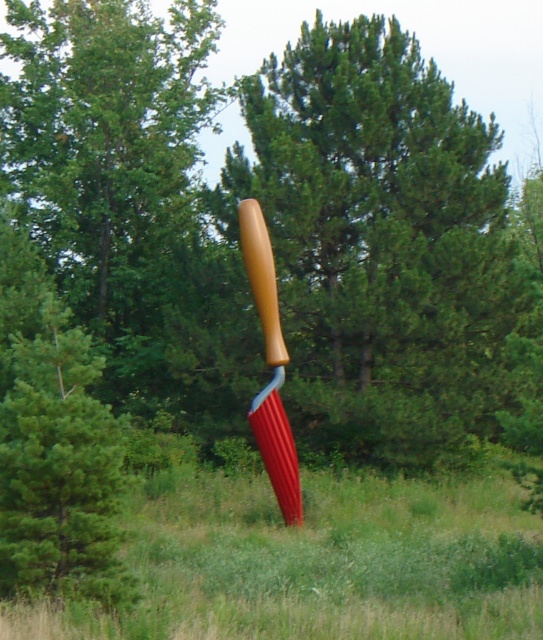
Question: Which of the following is the farthest from the observer?

Choices:
 (A) wooden handle baseball bat at center
 (B) smooth brown handle at center

Answer: (B)

Question: Observing the image, what is the correct spatial positioning of smooth brown handle at center in reference to wooden handle baseball bat at center?

Choices:
 (A) right
 (B) left

Answer: (A)

Question: Where is smooth brown handle at center located in relation to wooden handle baseball bat at center in the image?

Choices:
 (A) below
 (B) above

Answer: (B)

Question: Which point is closer to the camera taking this photo?

Choices:
 (A) (263, 400)
 (B) (409, 333)

Answer: (A)

Question: Can you confirm if smooth brown handle at center is positioned to the left of wooden handle baseball bat at center?

Choices:
 (A) no
 (B) yes

Answer: (A)